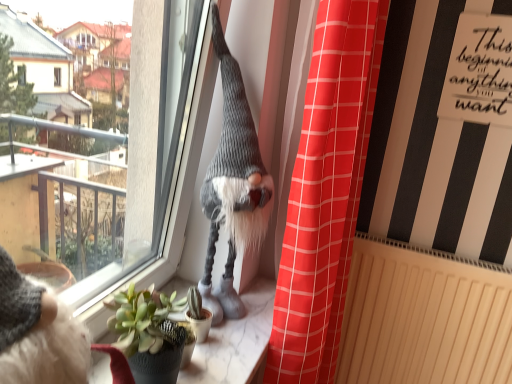
Question: Is knitted gray gnome at center in front of or behind transparent glass window at upper center in the image?

Choices:
 (A) behind
 (B) front

Answer: (A)

Question: Is point (249, 148) positioned closer to the camera than point (82, 253)?

Choices:
 (A) farther
 (B) closer

Answer: (B)

Question: Estimate the real-world distances between objects in this image. Which object is closer to the marble at center?

Choices:
 (A) transparent glass window at upper center
 (B) red plaid curtain at center
 (C) white paper at upper right
 (D) knitted gray gnome at center
 (E) beige textured radiator at lower right

Answer: (D)

Question: Which of these objects is positioned farthest from the beige textured radiator at lower right?

Choices:
 (A) red plaid curtain at center
 (B) knitted gray gnome at center
 (C) transparent glass window at upper center
 (D) green succulent at lower left
 (E) white paper at upper right

Answer: (C)